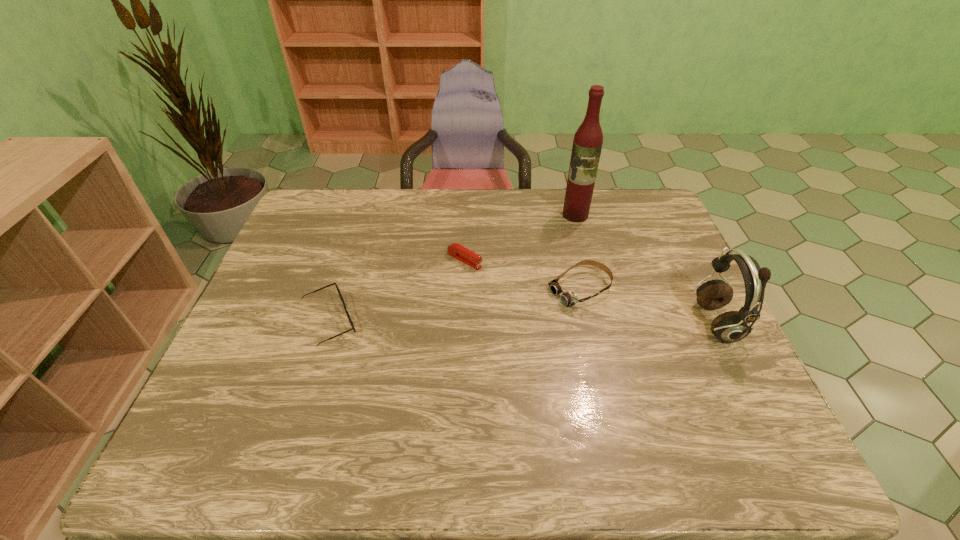
The image size is (960, 540). I want to click on vacant space on the desktop that is between the leftmost object and the earphone and is positioned on the label of the tallest object, so click(545, 323).

Image resolution: width=960 pixels, height=540 pixels. I want to click on vacant space on the desktop that is between the leftmost object and the second tallest object and is positioned on the front-facing side of the goggles, so click(x=511, y=323).

Where is `vacant spot on the desktop that is between the leftmost object and the fourth shortest object and is positioned on the front-facing side of the shortest object`? This screenshot has width=960, height=540. vacant spot on the desktop that is between the leftmost object and the fourth shortest object and is positioned on the front-facing side of the shortest object is located at coordinates (581, 323).